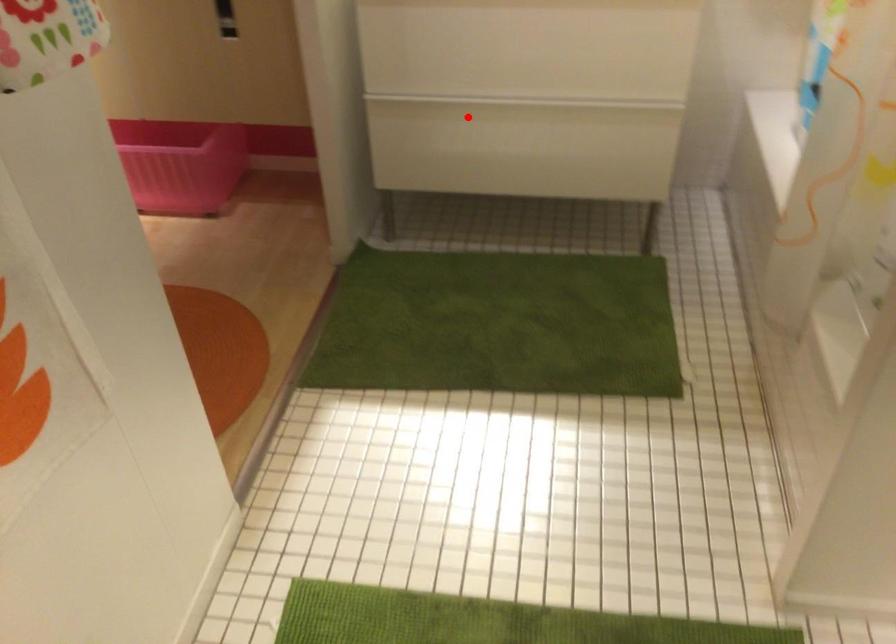
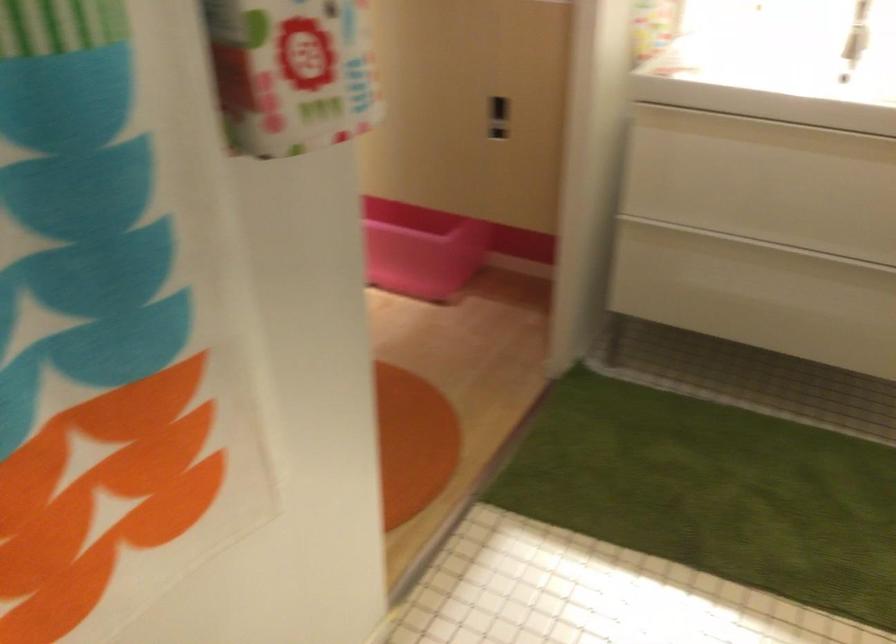
Question: I am providing you with two images of the same scene from different viewpoints. Image1 has a red point marked. In image2, the corresponding 3D location appears at what relative position? Reply with the corresponding letter.

Choices:
 (A) Closer
 (B) Farther

Answer: (A)